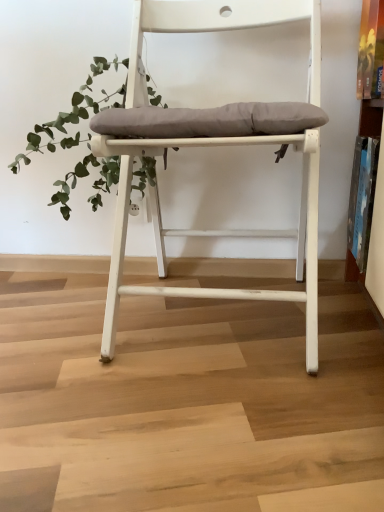
Question: From a real-world perspective, relative to white matte chair at center, is green leafy plant at upper left vertically above or below?

Choices:
 (A) above
 (B) below

Answer: (A)

Question: Does point (107, 65) appear closer or farther from the camera than point (119, 230)?

Choices:
 (A) closer
 (B) farther

Answer: (B)

Question: Is green leafy plant at upper left in front of or behind white matte chair at center in the image?

Choices:
 (A) behind
 (B) front

Answer: (A)

Question: In terms of size, does white matte chair at center appear bigger or smaller than green leafy plant at upper left?

Choices:
 (A) big
 (B) small

Answer: (A)

Question: From a real-world perspective, relative to green leafy plant at upper left, is white matte chair at center vertically above or below?

Choices:
 (A) above
 (B) below

Answer: (B)

Question: From the image's perspective, is white matte chair at center above or below green leafy plant at upper left?

Choices:
 (A) above
 (B) below

Answer: (B)

Question: Looking at their shapes, would you say white matte chair at center is wider or thinner than green leafy plant at upper left?

Choices:
 (A) thin
 (B) wide

Answer: (B)